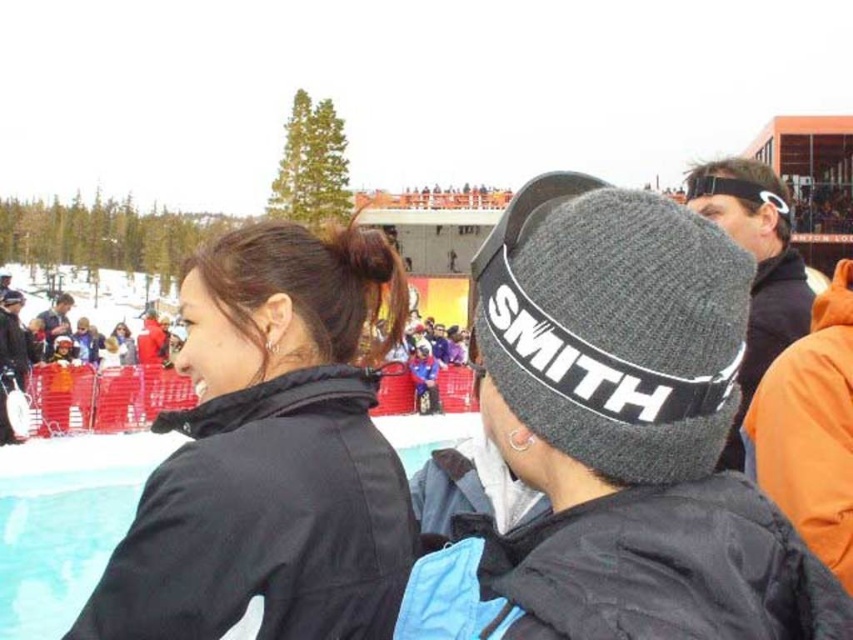
Question: Is knit gray beanie at center smaller than black matte jacket at left?

Choices:
 (A) yes
 (B) no

Answer: (A)

Question: Which object is closer to the camera taking this photo?

Choices:
 (A) black matte jacket at left
 (B) knit gray beanie at center

Answer: (B)

Question: Among these points, which one is nearest to the camera?

Choices:
 (A) (352, 528)
 (B) (758, 612)

Answer: (B)

Question: Observing the image, what is the correct spatial positioning of knit gray beanie at center in reference to black matte jacket at left?

Choices:
 (A) left
 (B) right

Answer: (B)

Question: Does knit gray beanie at center have a greater width compared to black matte jacket at left?

Choices:
 (A) no
 (B) yes

Answer: (A)